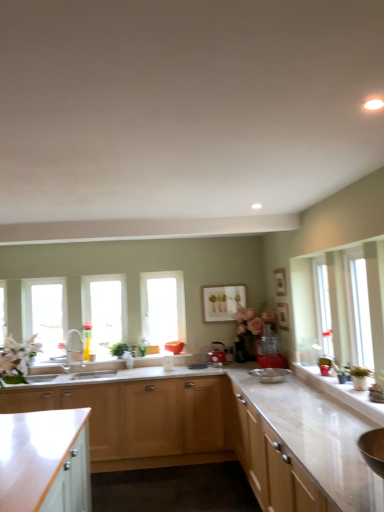
This screenshot has width=384, height=512. What do you see at coordinates (45, 461) in the screenshot?
I see `white glossy cabinet at lower left, positioned as the third cabinetry in right-to-left order` at bounding box center [45, 461].

This screenshot has width=384, height=512. I want to click on transparent glass window at center, the first window positioned from the right, so click(163, 307).

The width and height of the screenshot is (384, 512). Identify the location of light wood cabinet at right, the 1th cabinetry positioned from the right. (271, 463).

In order to face green leafy plant at center, should I rotate leftwards or rightwards?

To align with it, rotate left about 10.119°.

Locate an element on the screen. This screenshot has height=512, width=384. white glossy cabinet at lower left, the first cabinetry viewed from the left is located at coordinates (45, 461).

Considering the sizes of white marble countertop at lower center and clear glass window at left, acting as the 3th window starting from the right, in the image, is white marble countertop at lower center bigger or smaller than clear glass window at left, acting as the 3th window starting from the right,?

Clearly, white marble countertop at lower center is larger in size than clear glass window at left, acting as the 3th window starting from the right.

From a real-world perspective, is white marble countertop at lower center positioned above or below clear glass window at left, the first window viewed from the left?

white marble countertop at lower center is below clear glass window at left, the first window viewed from the left.

Is point (329, 429) positioned behind point (53, 305)?

That is False.

Does white marble countertop at lower center lie behind clear glass window at left, acting as the 3th window starting from the right?

No, the depth of white marble countertop at lower center is less than that of clear glass window at left, acting as the 3th window starting from the right.

At what (x,y) coordinates should I click in order to perform the action: click on appliance that appears below the green leafy plant at center (from a real-world perspective). Please return your answer as a coordinate pair (x, y). The width and height of the screenshot is (384, 512). Looking at the image, I should click on (216, 354).

Measure the distance from metallic red kettle at center, the 2th appliance positioned from the front, to green leafy plant at center.

They are 3.80 feet apart.

From a real-world perspective, does metallic red kettle at center, which is the first appliance in left-to-right order, stand above green leafy plant at center?

Incorrect, from a real-world perspective, metallic red kettle at center, which is the first appliance in left-to-right order, is lower than green leafy plant at center.

From the image's perspective, relative to green leafy plant at center, is metallic red kettle at center, the first appliance positioned from the back, above or below?

Clearly, from the image's perspective, metallic red kettle at center, the first appliance positioned from the back, is below green leafy plant at center.

Is light wood cabinet at lower center, which is the 2th cabinetry in right-to-left order, shorter than light wood cabinet at right, the 1th cabinetry positioned from the right?

Incorrect, the height of light wood cabinet at lower center, which is the 2th cabinetry in right-to-left order, does not fall short of that of light wood cabinet at right, the 1th cabinetry positioned from the right.

Between light wood cabinet at lower center, which is the 2th cabinetry in right-to-left order, and light wood cabinet at right, placed as the third cabinetry when sorted from left to right, which one has smaller size?

With smaller size is light wood cabinet at right, placed as the third cabinetry when sorted from left to right.

Between light wood cabinet at lower center, acting as the second cabinetry starting from the left, and light wood cabinet at right, placed as the third cabinetry when sorted from left to right, which one has smaller width?

Thinner between the two is light wood cabinet at right, placed as the third cabinetry when sorted from left to right.

Based on the photo, which is behind, light wood cabinet at lower center, acting as the second cabinetry starting from the left, or light wood cabinet at right, placed as the third cabinetry when sorted from left to right?

light wood cabinet at lower center, acting as the second cabinetry starting from the left, is further away from the camera.

Can white marble countertop at lower center be found inside clear glass window at left, acting as the 3th window starting from the right?

Actually, white marble countertop at lower center is outside clear glass window at left, acting as the 3th window starting from the right.

Considering the sizes of objects clear glass window at left, acting as the 3th window starting from the right, and white marble countertop at lower center in the image provided, who is shorter, clear glass window at left, acting as the 3th window starting from the right, or white marble countertop at lower center?

With less height is white marble countertop at lower center.

Consider the image. Considering the relative sizes of clear glass window at left, acting as the 3th window starting from the right, and white marble countertop at lower center in the image provided, is clear glass window at left, acting as the 3th window starting from the right, wider than white marble countertop at lower center?

In fact, clear glass window at left, acting as the 3th window starting from the right, might be narrower than white marble countertop at lower center.

Does clear glass window at left, acting as the 3th window starting from the right, appear on the left side of white marble countertop at lower center?

Correct, you'll find clear glass window at left, acting as the 3th window starting from the right, to the left of white marble countertop at lower center.

Who is bigger, light wood cabinet at right, the 1th cabinetry positioned from the right, or matte white picture frame at center?

light wood cabinet at right, the 1th cabinetry positioned from the right.

Find the location of a particular element. picture frame above the light wood cabinet at right, placed as the third cabinetry when sorted from left to right (from the image's perspective) is located at coordinates (222, 302).

Is matte white picture frame at center completely or partially inside light wood cabinet at right, the 1th cabinetry positioned from the right?

Definitely not — matte white picture frame at center is not inside light wood cabinet at right, the 1th cabinetry positioned from the right.

From a real-world perspective, does light wood cabinet at right, placed as the third cabinetry when sorted from left to right, stand above matte white picture frame at center?

No, from a real-world perspective, light wood cabinet at right, placed as the third cabinetry when sorted from left to right, is not above matte white picture frame at center.

From a real-world perspective, is clear glass window at left, acting as the 3th window starting from the right, over red plastic blender at center, the first appliance viewed from the front?

Correct, in the physical world, clear glass window at left, acting as the 3th window starting from the right, is higher than red plastic blender at center, the first appliance viewed from the front.

From the image's perspective, would you say clear glass window at left, the first window viewed from the left, is shown under red plastic blender at center, acting as the 2th appliance starting from the left?

Actually, clear glass window at left, the first window viewed from the left, appears above red plastic blender at center, acting as the 2th appliance starting from the left, in the image.

In the image, is clear glass window at left, acting as the 3th window starting from the right, positioned in front of or behind red plastic blender at center, the first appliance viewed from the front?

clear glass window at left, acting as the 3th window starting from the right, is behind red plastic blender at center, the first appliance viewed from the front.

What's the angular difference between clear glass window at left, acting as the 3th window starting from the right, and red plastic blender at center, acting as the 2th appliance starting from the left,'s facing directions?

The facing directions of clear glass window at left, acting as the 3th window starting from the right, and red plastic blender at center, acting as the 2th appliance starting from the left, are 90.7 degrees apart.

Is clear glass window at left, acting as the 3th window starting from the right, surrounded by matte white picture frame at center?

No.

Considering the relative positions of matte white picture frame at center and clear glass window at left, the first window viewed from the left, in the image provided, is matte white picture frame at center to the right of clear glass window at left, the first window viewed from the left, from the viewer's perspective?

Yes, matte white picture frame at center is to the right of clear glass window at left, the first window viewed from the left.

Does point (222, 302) appear closer or farther from the camera than point (55, 328)?

Point (222, 302).

From a real-world perspective, is matte white picture frame at center on clear glass window at left, acting as the 3th window starting from the right?

Correct, in the physical world, matte white picture frame at center is higher than clear glass window at left, acting as the 3th window starting from the right.

Where is `countertop in front of the clear glass window at left, acting as the 3th window starting from the right`? The image size is (384, 512). countertop in front of the clear glass window at left, acting as the 3th window starting from the right is located at coordinates (222, 431).

At what (x,y) coordinates should I click in order to perform the action: click on appliance directly beneath the green leafy plant at center (from a real-world perspective). Please return your answer as a coordinate pair (x, y). Looking at the image, I should click on (216, 354).

Estimate the real-world distances between objects in this image. Which object is closer to white glossy counter top at right, clear glass window at center, the second window when ordered from left to right, or matte white picture frame at center?

matte white picture frame at center lies closer to white glossy counter top at right than the other object.

Estimate the real-world distances between objects in this image. Which object is closer to clear glass window at center, the 2th window from the right, matte white picture frame at center or transparent glass window at center, which ranks as the third window in left-to-right order?

transparent glass window at center, which ranks as the third window in left-to-right order.

Based on their spatial positions, is green leafy plant at center or transparent glass window at center, which ranks as the third window in left-to-right order, closer to metallic red kettle at center, the 2th appliance positioned from the front?

The object closer to metallic red kettle at center, the 2th appliance positioned from the front, is transparent glass window at center, which ranks as the third window in left-to-right order.

From the image, which object appears to be farther from matte white picture frame at center, clear glass window at center, the second window when ordered from left to right, or metallic red kettle at center, which is the 2th appliance from right to left?

Based on the image, clear glass window at center, the second window when ordered from left to right, appears to be further to matte white picture frame at center.

Which object lies nearer to the anchor point clear glass window at center, the second window when ordered from left to right, matte white picture frame at center or metallic red kettle at center, which is the 2th appliance from right to left?

The object closer to clear glass window at center, the second window when ordered from left to right, is matte white picture frame at center.

Based on their spatial positions, is white glossy cabinet at lower left, positioned as the third cabinetry in right-to-left order, or white marble countertop at lower center further from red plastic blender at center, the first appliance viewed from the front?

white glossy cabinet at lower left, positioned as the third cabinetry in right-to-left order, is positioned further to the anchor red plastic blender at center, the first appliance viewed from the front.

Based on their spatial positions, is white glossy counter top at right or matte white picture frame at center further from clear glass window at left, acting as the 3th window starting from the right?

The object further to clear glass window at left, acting as the 3th window starting from the right, is white glossy counter top at right.

Estimate the real-world distances between objects in this image. Which object is closer to white marble countertop at lower center, clear glass window at center, the second window when ordered from left to right, or matte white picture frame at center?

matte white picture frame at center lies closer to white marble countertop at lower center than the other object.

Identify the location of appliance between clear glass window at center, the 2th window from the right, and matte white picture frame at center from left to right. This screenshot has height=512, width=384. (216, 354).

Identify the location of plant between clear glass window at left, the first window viewed from the left, and light wood cabinet at lower center, acting as the second cabinetry starting from the left, from left to right. (118, 349).

Where is `appliance between light wood cabinet at right, the 1th cabinetry positioned from the right, and metallic red kettle at center, the first appliance positioned from the back, in the front-back direction`? Image resolution: width=384 pixels, height=512 pixels. appliance between light wood cabinet at right, the 1th cabinetry positioned from the right, and metallic red kettle at center, the first appliance positioned from the back, in the front-back direction is located at coordinates (269, 350).

Find the location of a particular element. The image size is (384, 512). counter top between white glossy cabinet at lower left, the first cabinetry viewed from the left, and metallic red kettle at center, the first appliance positioned from the back, from front to back is located at coordinates click(x=341, y=392).